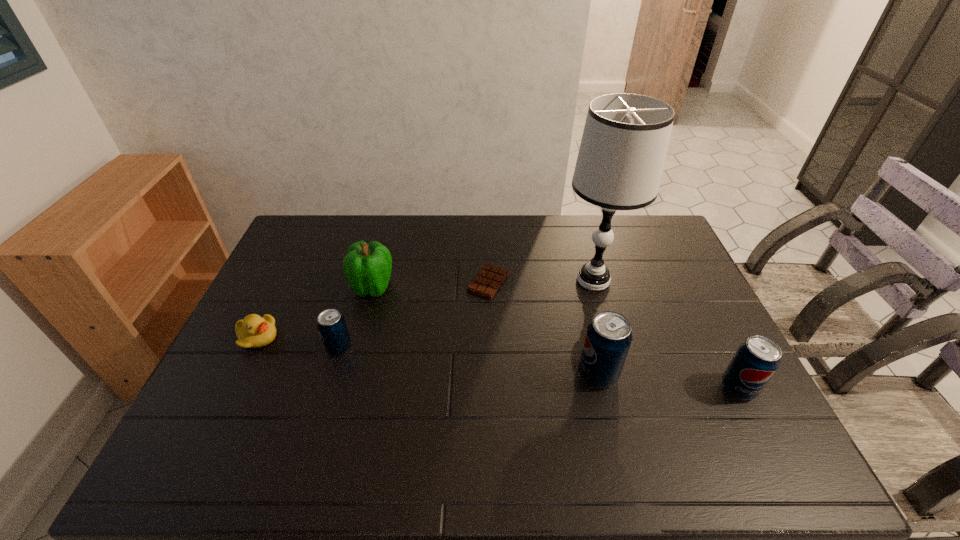
You are a GUI agent. You are given a task and a screenshot of the screen. Output one action in this format:
    pyautogui.click(x=<x>, y=<y>)
    Task: Click on the duckling
    The width and height of the screenshot is (960, 540).
    Given the screenshot: What is the action you would take?
    pyautogui.click(x=254, y=331)

I want to click on vacant point located on the left of the leftmost soda can, so click(301, 348).

The height and width of the screenshot is (540, 960). I want to click on blank space located 0.150m on the right of the tallest soda can, so click(x=675, y=374).

Find the location of a particular element. free point located on the back of the rightmost soda can is located at coordinates (681, 274).

The height and width of the screenshot is (540, 960). Find the location of `vacant area located on the left of the tallest object`. vacant area located on the left of the tallest object is located at coordinates (436, 280).

At what (x,y) coordinates should I click in order to perform the action: click on free space located 0.110m on the back of the bell pepper. Please return your answer as a coordinate pair (x, y). The image size is (960, 540). Looking at the image, I should click on (382, 252).

Where is `vacant area situated 0.330m on the front of the candy bar`? The image size is (960, 540). vacant area situated 0.330m on the front of the candy bar is located at coordinates (491, 390).

At what (x,y) coordinates should I click in order to perform the action: click on free space located 0.230m on the front-facing side of the duckling. Please return your answer as a coordinate pair (x, y). The image size is (960, 540). Looking at the image, I should click on (357, 337).

Where is `object at the near edge`? Image resolution: width=960 pixels, height=540 pixels. object at the near edge is located at coordinates (756, 360).

Image resolution: width=960 pixels, height=540 pixels. Find the location of `object that is at the left edge`. object that is at the left edge is located at coordinates (254, 331).